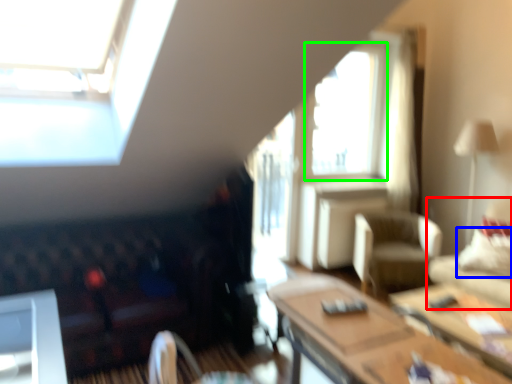
Question: Considering the real-world distances, which object is closest to studio couch (highlighted by a red box)? pillow (highlighted by a blue box) or window (highlighted by a green box).

Choices:
 (A) pillow
 (B) window

Answer: (A)